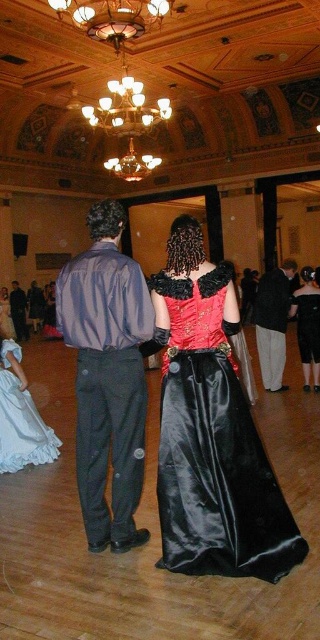
You are a photographer positioned at the entrance of the ballroom. You need to capture a photo of both the shiny satin dress at center and the shiny purple shirt at center. Which object should you focus on first if you want to include both in the frame without moving the camera?

The shiny satin dress at center is not as tall as the shiny purple shirt at center, so you should focus on the shiny purple shirt at center first since it is taller and will require more space in the frame.

You are a photographer positioned at the entrance of the ballroom. You need to capture a photo where both the white satin dress at lower left and the silky blue shirt at center are visible. Considering their heights, which object might appear smaller in the photo?

The white satin dress at lower left appears smaller in the photo because it is not as tall as the silky blue shirt at center.